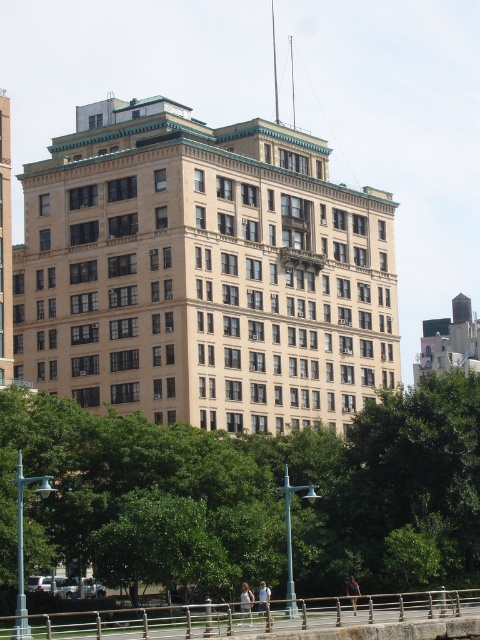
Is green leafy tree at center below light blue denim jeans at center?

Actually, green leafy tree at center is above light blue denim jeans at center.

Which is below, green leafy tree at center or light blue denim jeans at center?

Positioned lower is light blue denim jeans at center.

Is point (470, 381) positioned after point (252, 600)?

Yes, it is.

Locate an element on the screen. The height and width of the screenshot is (640, 480). green leafy tree at center is located at coordinates (251, 497).

Locate an element on the screen. The height and width of the screenshot is (640, 480). light blue denim jeans at center is located at coordinates (245, 602).

Who is taller, light blue denim jeans at center or white cotton shirt at lower center?

With more height is light blue denim jeans at center.

Measure the distance between light blue denim jeans at center and camera.

light blue denim jeans at center is 171.94 feet from camera.

Where is `light blue denim jeans at center`? The image size is (480, 640). light blue denim jeans at center is located at coordinates (245, 602).

Who is more forward, (x=171, y=440) or (x=263, y=589)?

Point (x=263, y=589) is more forward.

Is point (189, 525) farther from viewer compared to point (266, 596)?

That is True.

This screenshot has width=480, height=640. I want to click on green leafy tree at center, so tap(251, 497).